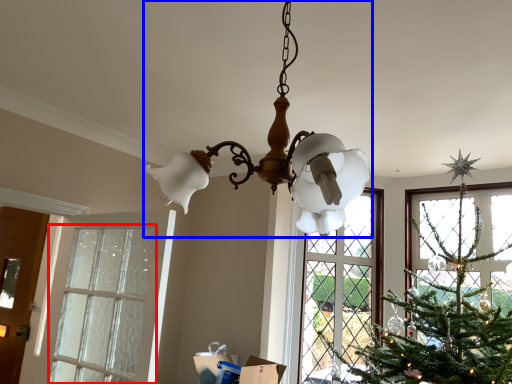
Question: Which object appears closest to the camera in this image, window (highlighted by a red box) or lamp (highlighted by a blue box)?

Choices:
 (A) window
 (B) lamp

Answer: (B)